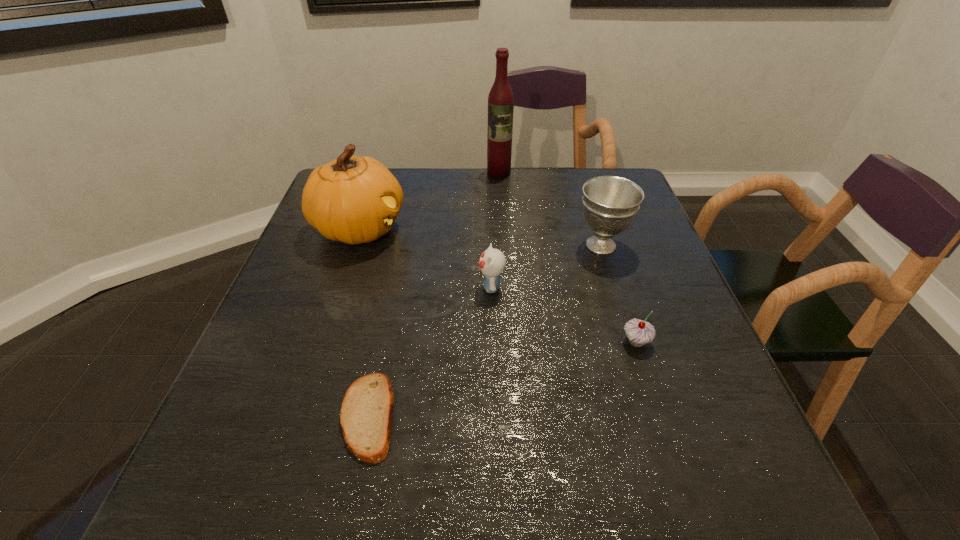
Where is `object located at the near edge`? This screenshot has width=960, height=540. object located at the near edge is located at coordinates (366, 415).

Locate an element on the screen. Image resolution: width=960 pixels, height=540 pixels. object situated at the left edge is located at coordinates pos(354,199).

The image size is (960, 540). I want to click on chalice that is at the right edge, so click(610, 203).

Identify the location of cupcake that is at the right edge. This screenshot has height=540, width=960. (639, 332).

What are the coordinates of `object at the far left corner` in the screenshot? It's located at (354, 199).

At what (x,y) coordinates should I click in order to perform the action: click on vacant space at the far edge of the desktop. Please return your answer as a coordinate pair (x, y). This screenshot has height=540, width=960. Looking at the image, I should click on (447, 199).

In the image, there is a desktop. At what (x,y) coordinates should I click in order to perform the action: click on free space at the near edge. Please return your answer as a coordinate pair (x, y). Looking at the image, I should click on (497, 495).

Locate an element on the screen. The height and width of the screenshot is (540, 960). vacant area at the left edge is located at coordinates (320, 314).

This screenshot has height=540, width=960. I want to click on vacant space at the right edge of the desktop, so click(x=731, y=455).

At what (x,y) coordinates should I click in order to perform the action: click on free space at the near right corner of the desktop. Please return your answer as a coordinate pair (x, y). The height and width of the screenshot is (540, 960). Looking at the image, I should click on (684, 484).